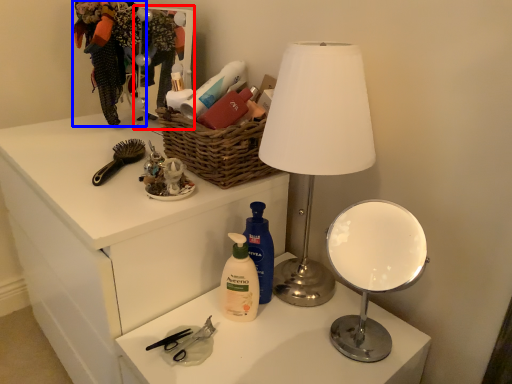
Question: Which of the following is the closest to the observer, mirror (highlighted by a red box) or clothing (highlighted by a blue box)?

Choices:
 (A) mirror
 (B) clothing

Answer: (A)